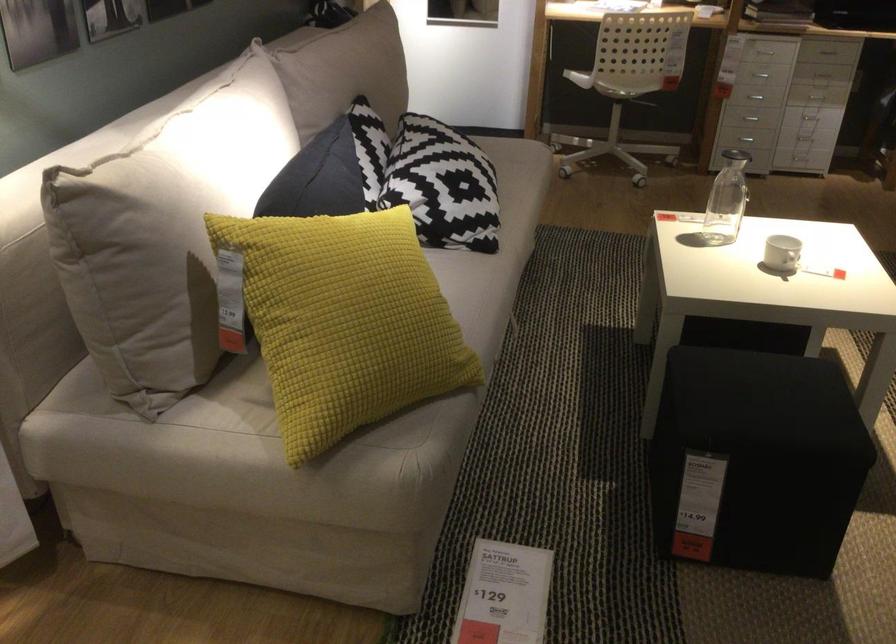
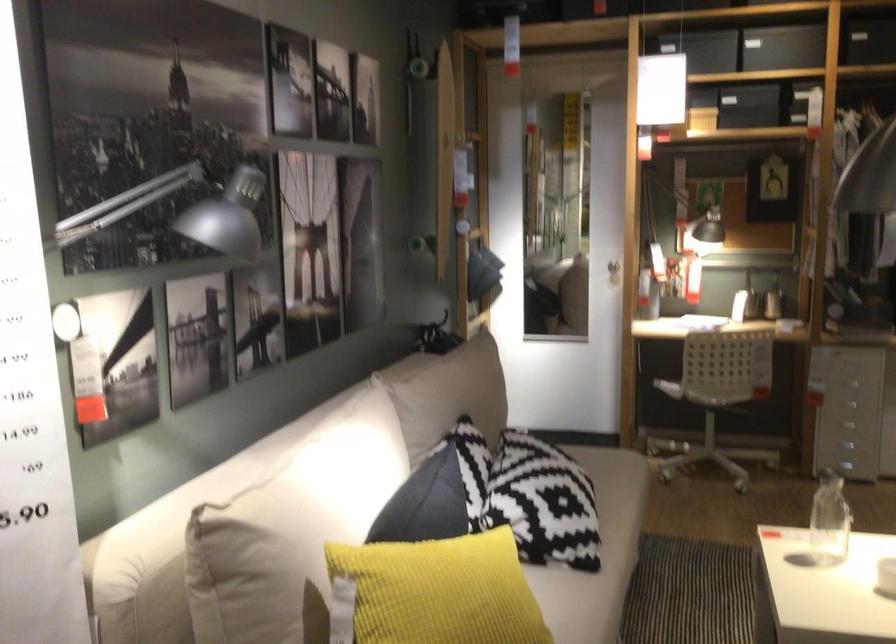
Question: The images are taken continuously from a first-person perspective. In which direction is your viewpoint rotating?

Choices:
 (A) Left
 (B) Right
 (C) Up
 (D) Down

Answer: (C)